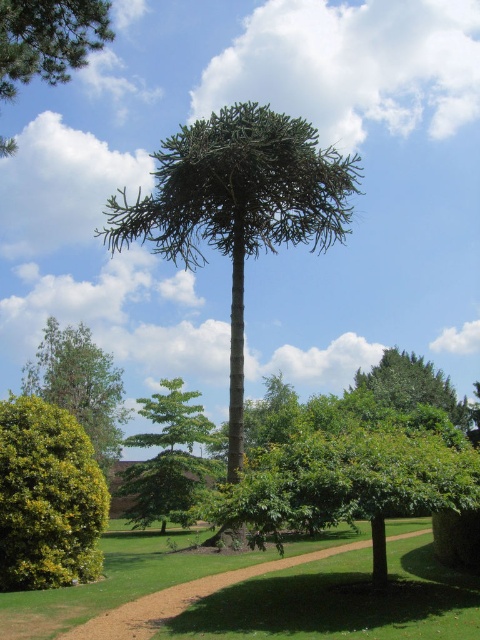
Question: Is green textured tree at center below green leafy tree at upper left?

Choices:
 (A) no
 (B) yes

Answer: (B)

Question: Considering the relative positions of green textured tree at center and green leafy tree at upper left in the image provided, where is green textured tree at center located with respect to green leafy tree at upper left?

Choices:
 (A) above
 (B) below

Answer: (B)

Question: Which object is the closest to the green leafy tree at lower left?

Choices:
 (A) green leafy bush at lower left
 (B) green textured tree at upper center

Answer: (B)

Question: Which point is closer to the camera?

Choices:
 (A) green textured tree at center
 (B) green leafy tree at center

Answer: (A)

Question: Considering the real-world distances, which object is farthest from the green leafy tree at lower left?

Choices:
 (A) green textured tree at center
 (B) green textured tree at upper center

Answer: (A)

Question: Does green textured tree at center appear on the right side of green leafy tree at upper left?

Choices:
 (A) no
 (B) yes

Answer: (B)